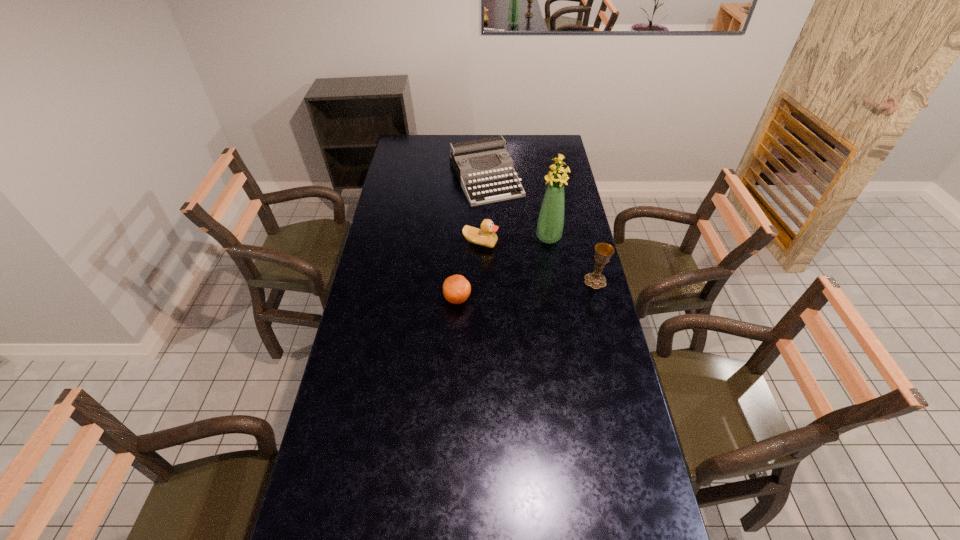
Identify the location of free location located 0.350m on the front-facing side of the bouquet. The height and width of the screenshot is (540, 960). (507, 300).

The width and height of the screenshot is (960, 540). Find the location of `free location located on the front-facing side of the bouquet`. free location located on the front-facing side of the bouquet is located at coordinates [x=535, y=258].

Locate an element on the screen. vacant space located on the typing side of the typewriter is located at coordinates (519, 242).

The width and height of the screenshot is (960, 540). I want to click on blank space located 0.080m on the typing side of the typewriter, so click(504, 215).

In order to click on free region located on the typing side of the typewriter in this screenshot , I will do `click(503, 214)`.

Locate an element on the screen. The height and width of the screenshot is (540, 960). vacant region located at the beak of the duck is located at coordinates (506, 279).

You are a GUI agent. You are given a task and a screenshot of the screen. Output one action in this format:
    pyautogui.click(x=<x>, y=<y>)
    Task: Click on the free space located 0.240m at the beak of the duck
    This screenshot has height=540, width=960.
    Given the screenshot: What is the action you would take?
    pyautogui.click(x=513, y=289)

I want to click on free location located 0.280m at the beak of the duck, so click(517, 297).

Where is `object that is at the far edge`? object that is at the far edge is located at coordinates (484, 150).

The height and width of the screenshot is (540, 960). What are the coordinates of `chalice at the right edge` in the screenshot? It's located at (603, 251).